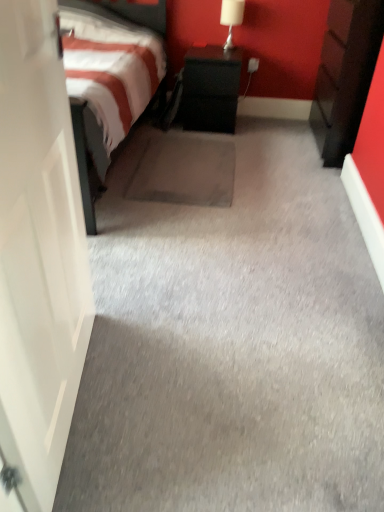
At what (x,y) coordinates should I click in order to perform the action: click on white glossy table lamp at upper right. Please return your answer as a coordinate pair (x, y). The image size is (384, 512). Looking at the image, I should click on (231, 18).

What do you see at coordinates (345, 75) in the screenshot?
I see `dark wood nightstand at right, the second nightstand from the left` at bounding box center [345, 75].

What are the coordinates of `black matte nightstand at center, the second nightstand in the right-to-left sequence` in the screenshot? It's located at (210, 89).

In the scene shown: Which is more to the right, black matte nightstand at center, the second nightstand in the right-to-left sequence, or white glossy table lamp at upper right?

From the viewer's perspective, white glossy table lamp at upper right appears more on the right side.

Does black matte nightstand at center, the 1th nightstand in the left-to-right sequence, have a lesser height compared to white glossy table lamp at upper right?

Incorrect, the height of black matte nightstand at center, the 1th nightstand in the left-to-right sequence, does not fall short of that of white glossy table lamp at upper right.

Is black matte nightstand at center, the 1th nightstand in the left-to-right sequence, directly adjacent to white glossy table lamp at upper right?

No, black matte nightstand at center, the 1th nightstand in the left-to-right sequence, is not next to white glossy table lamp at upper right.

Considering the relative sizes of black matte nightstand at center, the second nightstand in the right-to-left sequence, and white glossy table lamp at upper right in the image provided, is black matte nightstand at center, the second nightstand in the right-to-left sequence, bigger than white glossy table lamp at upper right?

Yes.

From the image's perspective, does dark wood nightstand at right, the second nightstand from the left, appear lower than white glossy table lamp at upper right?

Correct, dark wood nightstand at right, the second nightstand from the left, appears lower than white glossy table lamp at upper right in the image.

Considering the points (348, 57) and (228, 25), which point is behind, point (348, 57) or point (228, 25)?

The point (228, 25) is behind.

Considering the relative positions of dark wood nightstand at right, positioned as the 1th nightstand in right-to-left order, and white glossy table lamp at upper right in the image provided, is dark wood nightstand at right, positioned as the 1th nightstand in right-to-left order, to the left or to the right of white glossy table lamp at upper right?

dark wood nightstand at right, positioned as the 1th nightstand in right-to-left order, is positioned on white glossy table lamp at upper right's right side.

Which object is closer to the camera, white glossy table lamp at upper right or black matte nightstand at center, the 1th nightstand in the left-to-right sequence?

Positioned in front is black matte nightstand at center, the 1th nightstand in the left-to-right sequence.

Between white glossy table lamp at upper right and black matte nightstand at center, the 1th nightstand in the left-to-right sequence, which one has more height?

Standing taller between the two is black matte nightstand at center, the 1th nightstand in the left-to-right sequence.

From the image's perspective, would you say white glossy table lamp at upper right is positioned over black matte nightstand at center, the 1th nightstand in the left-to-right sequence?

Yes.

Can you tell me how much black matte nightstand at center, the second nightstand in the right-to-left sequence, and dark wood nightstand at right, the second nightstand from the left, differ in facing direction?

They differ by 90.7 degrees in their facing directions.

Can you confirm if black matte nightstand at center, the second nightstand in the right-to-left sequence, is shorter than dark wood nightstand at right, the second nightstand from the left?

Yes, black matte nightstand at center, the second nightstand in the right-to-left sequence, is shorter than dark wood nightstand at right, the second nightstand from the left.

Is dark wood nightstand at right, the second nightstand from the left, inside black matte nightstand at center, the second nightstand in the right-to-left sequence?

Definitely not — dark wood nightstand at right, the second nightstand from the left, is not inside black matte nightstand at center, the second nightstand in the right-to-left sequence.

From the image's perspective, between black matte nightstand at center, the 1th nightstand in the left-to-right sequence, and dark wood nightstand at right, positioned as the 1th nightstand in right-to-left order, which one is located above?

black matte nightstand at center, the 1th nightstand in the left-to-right sequence, from the image's perspective.

Is white glossy table lamp at upper right oriented away from dark wood nightstand at right, positioned as the 1th nightstand in right-to-left order?

That's not correct — white glossy table lamp at upper right is not looking away from dark wood nightstand at right, positioned as the 1th nightstand in right-to-left order.

Is white glossy table lamp at upper right not inside dark wood nightstand at right, positioned as the 1th nightstand in right-to-left order?

Yes, white glossy table lamp at upper right is outside of dark wood nightstand at right, positioned as the 1th nightstand in right-to-left order.

From their relative heights in the image, would you say white glossy table lamp at upper right is taller or shorter than dark wood nightstand at right, positioned as the 1th nightstand in right-to-left order?

In the image, white glossy table lamp at upper right appears to be shorter than dark wood nightstand at right, positioned as the 1th nightstand in right-to-left order.

Is dark wood nightstand at right, positioned as the 1th nightstand in right-to-left order, facing towards black matte nightstand at center, the 1th nightstand in the left-to-right sequence?

Yes, dark wood nightstand at right, positioned as the 1th nightstand in right-to-left order, is oriented towards black matte nightstand at center, the 1th nightstand in the left-to-right sequence.

Consider the image. Is dark wood nightstand at right, positioned as the 1th nightstand in right-to-left order, shorter than black matte nightstand at center, the 1th nightstand in the left-to-right sequence?

No, dark wood nightstand at right, positioned as the 1th nightstand in right-to-left order, is not shorter than black matte nightstand at center, the 1th nightstand in the left-to-right sequence.

In the scene shown: Is dark wood nightstand at right, the second nightstand from the left, inside or outside of black matte nightstand at center, the second nightstand in the right-to-left sequence?

dark wood nightstand at right, the second nightstand from the left, is located beyond the bounds of black matte nightstand at center, the second nightstand in the right-to-left sequence.

Is dark wood nightstand at right, the second nightstand from the left, positioned far away from black matte nightstand at center, the second nightstand in the right-to-left sequence?

They are positioned close to each other.

From the image's perspective, starting from the white glossy table lamp at upper right, which nightstand is the 1st one below? Please provide its 2D coordinates.

[(210, 89)]

Locate an element on the screen. Image resolution: width=384 pixels, height=512 pixels. table lamp on the left of dark wood nightstand at right, positioned as the 1th nightstand in right-to-left order is located at coordinates (231, 18).

Consider the image. Which object lies further to the anchor point black matte nightstand at center, the second nightstand in the right-to-left sequence, dark wood nightstand at right, positioned as the 1th nightstand in right-to-left order, or white glossy table lamp at upper right?

dark wood nightstand at right, positioned as the 1th nightstand in right-to-left order, is further to black matte nightstand at center, the second nightstand in the right-to-left sequence.

Which object lies further to the anchor point white glossy table lamp at upper right, dark wood nightstand at right, the second nightstand from the left, or black matte nightstand at center, the second nightstand in the right-to-left sequence?

Based on the image, dark wood nightstand at right, the second nightstand from the left, appears to be further to white glossy table lamp at upper right.

Which object lies nearer to the anchor point black matte nightstand at center, the 1th nightstand in the left-to-right sequence, white glossy table lamp at upper right or dark wood nightstand at right, the second nightstand from the left?

Among the two, white glossy table lamp at upper right is located nearer to black matte nightstand at center, the 1th nightstand in the left-to-right sequence.

When comparing their distances from dark wood nightstand at right, positioned as the 1th nightstand in right-to-left order, does black matte nightstand at center, the 1th nightstand in the left-to-right sequence, or white glossy table lamp at upper right seem further?

The object further to dark wood nightstand at right, positioned as the 1th nightstand in right-to-left order, is white glossy table lamp at upper right.

From the image, which object appears to be nearer to dark wood nightstand at right, the second nightstand from the left, white glossy table lamp at upper right or black matte nightstand at center, the second nightstand in the right-to-left sequence?

black matte nightstand at center, the second nightstand in the right-to-left sequence, is positioned closer to the anchor dark wood nightstand at right, the second nightstand from the left.

Based on their spatial positions, is black matte nightstand at center, the second nightstand in the right-to-left sequence, or dark wood nightstand at right, the second nightstand from the left, further from white glossy table lamp at upper right?

dark wood nightstand at right, the second nightstand from the left.

You are a GUI agent. You are given a task and a screenshot of the screen. Output one action in this format:
    pyautogui.click(x=<x>, y=<y>)
    Task: Click on the table lamp located between black matte nightstand at center, the second nightstand in the right-to-left sequence, and dark wood nightstand at right, the second nightstand from the left, in the left-right direction
    The height and width of the screenshot is (512, 384).
    Given the screenshot: What is the action you would take?
    pyautogui.click(x=231, y=18)